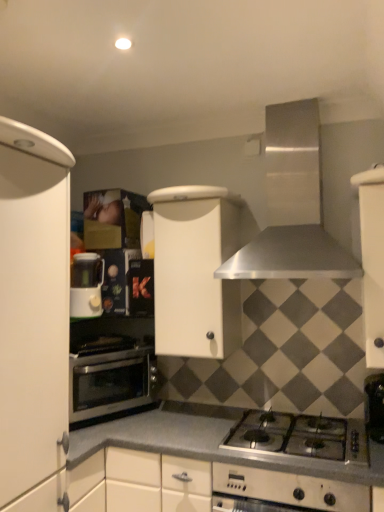
Where is `empty space that is ontop of stainless steel range hood at upper center (from a real-world perspective)`? empty space that is ontop of stainless steel range hood at upper center (from a real-world perspective) is located at coordinates (281, 86).